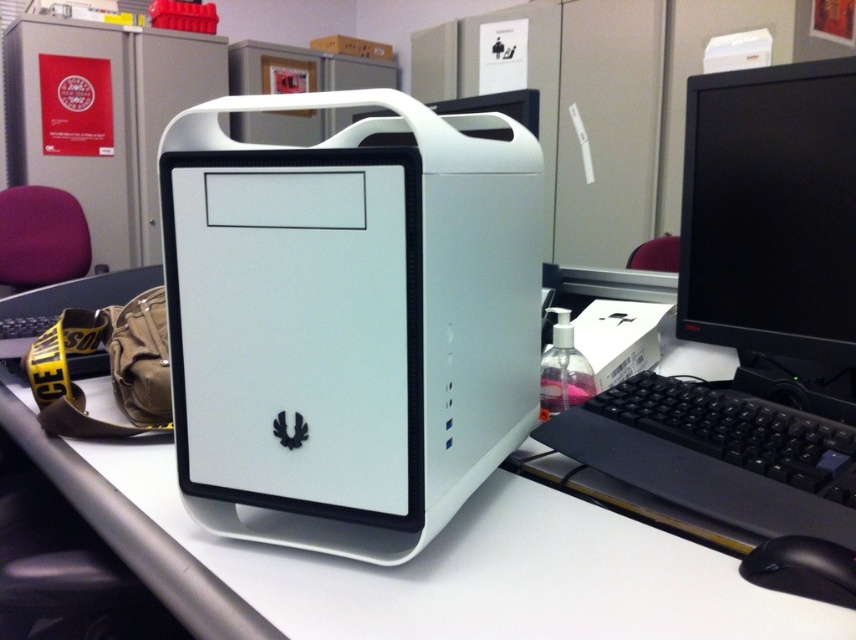
Question: Which of the following is the closest to the observer?

Choices:
 (A) white plastic computer at center
 (B) white plastic computer desk at center
 (C) black plastic keyboard at center

Answer: (A)

Question: Where is white plastic computer at center located in relation to black plastic mouse at lower right in the image?

Choices:
 (A) right
 (B) left

Answer: (B)

Question: Can you confirm if white plastic computer at center is positioned below black glossy monitor at right?

Choices:
 (A) no
 (B) yes

Answer: (B)

Question: Which of the following is the farthest from the observer?

Choices:
 (A) white plastic computer desk at center
 (B) black glossy monitor at right
 (C) black plastic keyboard at center

Answer: (B)

Question: Which point is farther to the camera?

Choices:
 (A) (385, 132)
 (B) (716, 509)

Answer: (A)

Question: Does white plastic computer desk at center have a lesser width compared to black plastic mouse at lower right?

Choices:
 (A) yes
 (B) no

Answer: (B)